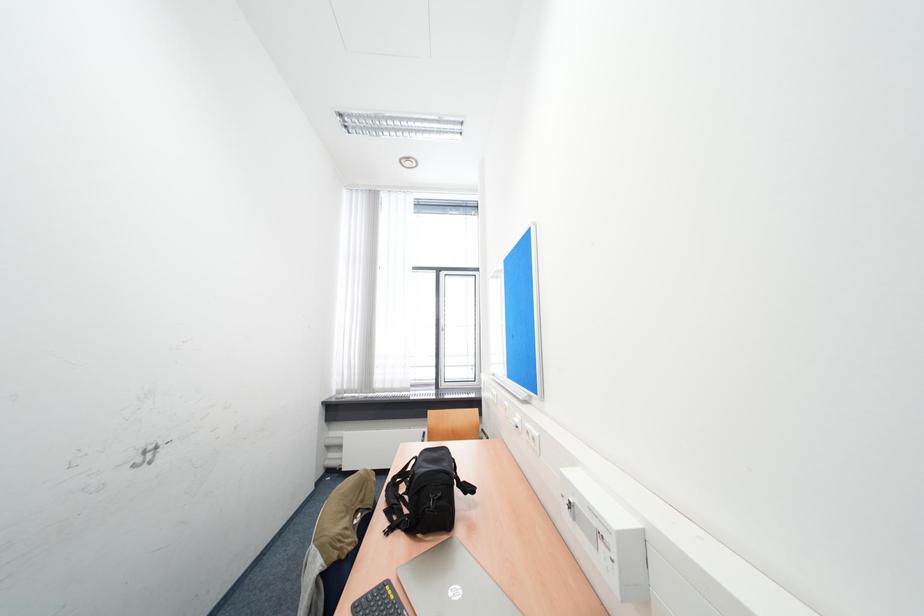
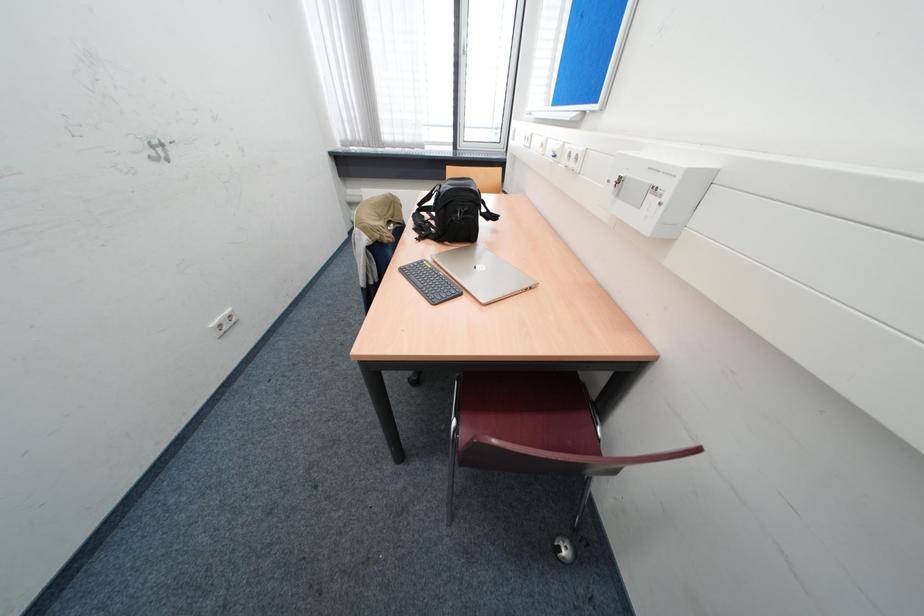
Question: The first image is from the beginning of the video and the second image is from the end. How did the camera likely rotate when shooting the video?

Choices:
 (A) Left
 (B) Right
 (C) Up
 (D) Down

Answer: (D)